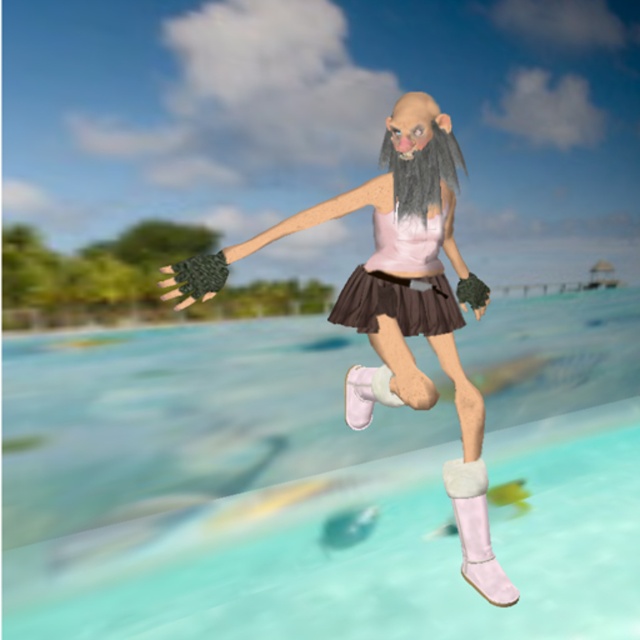
Question: Is matte pink tank top at center wider than pink matte dress at center?

Choices:
 (A) yes
 (B) no

Answer: (A)

Question: Which of the following is the farthest from the observer?

Choices:
 (A) matte pink tank top at center
 (B) black matte hair at center
 (C) pink matte dress at center

Answer: (C)

Question: Is clear blue water at center in front of black matte hair at center?

Choices:
 (A) yes
 (B) no

Answer: (B)

Question: Which object is the closest to the black matte hair at center?

Choices:
 (A) clear blue water at center
 (B) matte pink tank top at center
 (C) pink matte dress at center

Answer: (C)

Question: Estimate the real-world distances between objects in this image. Which object is closer to the clear blue water at center?

Choices:
 (A) matte pink tank top at center
 (B) black matte hair at center
 (C) pink matte dress at center

Answer: (A)

Question: Is clear blue water at center thinner than pink matte dress at center?

Choices:
 (A) yes
 (B) no

Answer: (B)